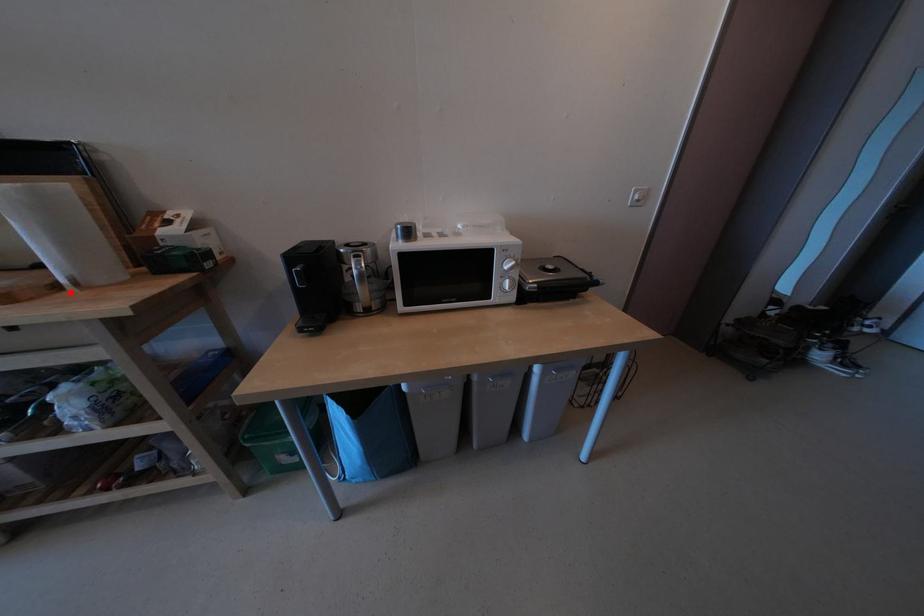
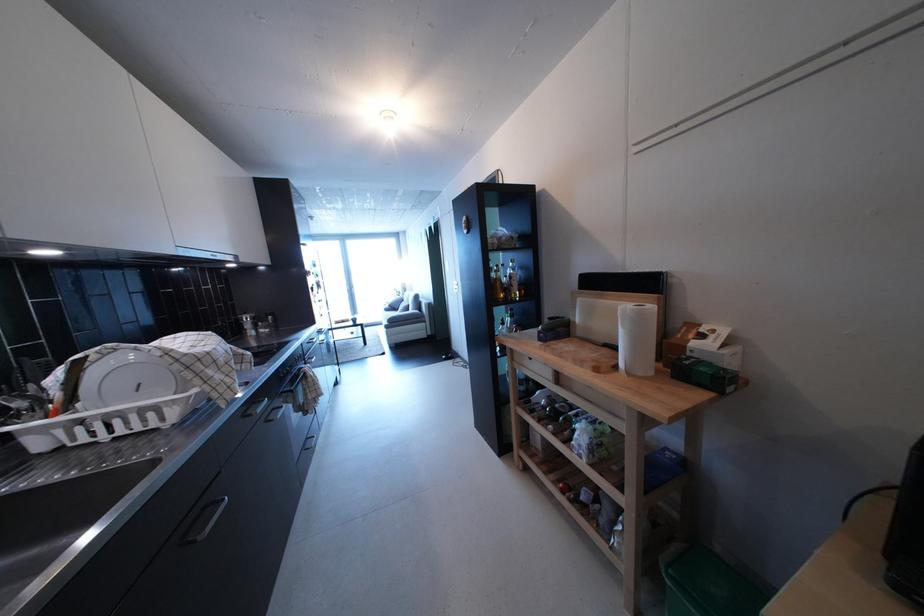
Where in the second image is the point corresponding to the highlighted location from the first image?

(628, 373)